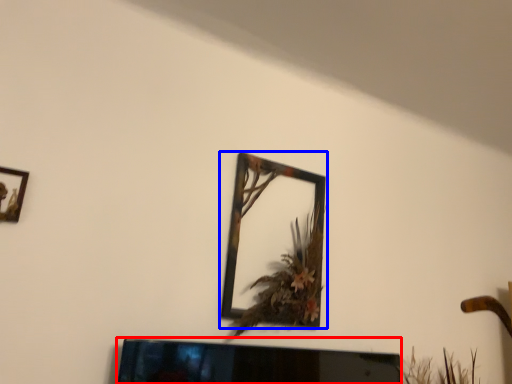
Question: Which object is further to the camera taking this photo, television (highlighted by a red box) or picture frame (highlighted by a blue box)?

Choices:
 (A) television
 (B) picture frame

Answer: (B)